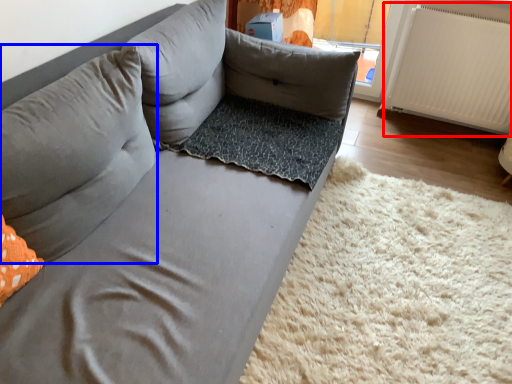
Question: Which object appears closest to the camera in this image, radiator (highlighted by a red box) or pillow (highlighted by a blue box)?

Choices:
 (A) radiator
 (B) pillow

Answer: (B)